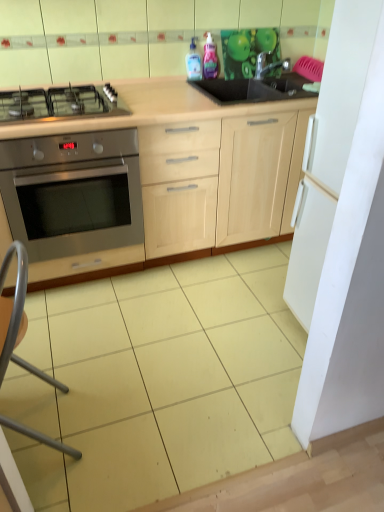
Question: Would you say satin silver gas stove at left is inside or outside pink glossy bottle at upper center, the 2th bottle positioned from the left?

Choices:
 (A) outside
 (B) inside

Answer: (A)

Question: In terms of width, does satin silver gas stove at left look wider or thinner when compared to pink glossy bottle at upper center, the first bottle when ordered from right to left?

Choices:
 (A) wide
 (B) thin

Answer: (A)

Question: Estimate the real-world distances between objects in this image. Which object is closer to the light wood cabinet at center?

Choices:
 (A) metallic faucet at upper right
 (B) satin silver gas stove at left
 (C) transparent plastic bottle at upper center, the 1th bottle positioned from the left
 (D) pink glossy bottle at upper center, the first bottle when ordered from right to left
 (E) stainless steel oven at left

Answer: (E)

Question: Estimate the real-world distances between objects in this image. Which object is farther from the pink glossy bottle at upper center, the first bottle when ordered from right to left?

Choices:
 (A) metallic silver folding chair at lower left
 (B) stainless steel oven at left
 (C) satin silver gas stove at left
 (D) light wood cabinet at center
 (E) transparent plastic bottle at upper center, which ranks as the second bottle in right-to-left order

Answer: (A)